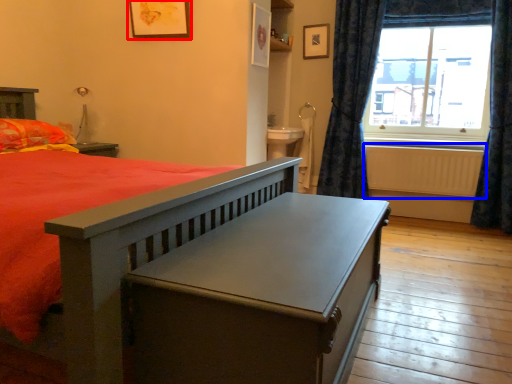
Question: Which of the following is the farthest to the observer, picture frame (highlighted by a red box) or radiator (highlighted by a blue box)?

Choices:
 (A) picture frame
 (B) radiator

Answer: (B)